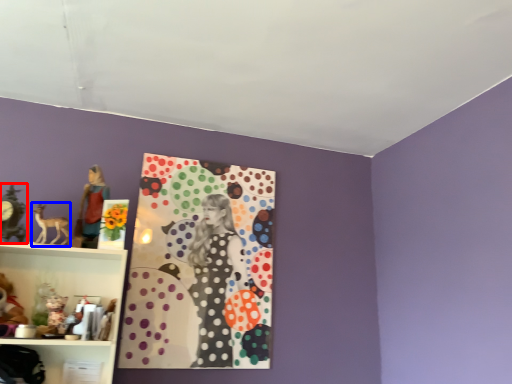
Question: Which object appears farthest to the camera in this image, art (highlighted by a red box) or animal (highlighted by a blue box)?

Choices:
 (A) art
 (B) animal

Answer: (B)